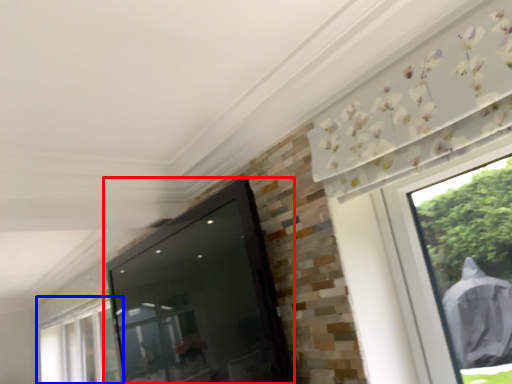
Question: Among these objects, which one is farthest to the camera, screen door (highlighted by a red box) or window (highlighted by a blue box)?

Choices:
 (A) screen door
 (B) window

Answer: (B)